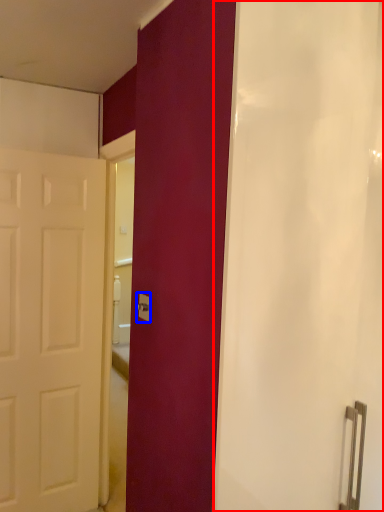
Question: Which object is further to the camera taking this photo, shower curtain (highlighted by a red box) or electric outlet (highlighted by a blue box)?

Choices:
 (A) shower curtain
 (B) electric outlet

Answer: (B)